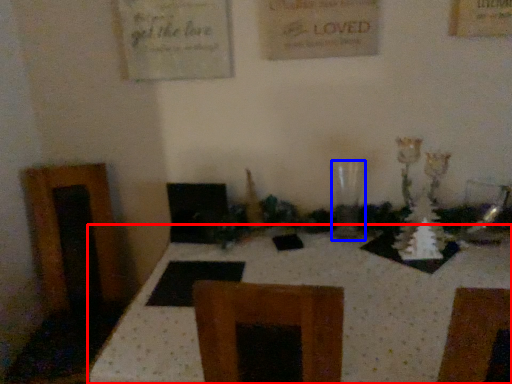
Question: Which object is closer to the camera taking this photo, table (highlighted by a red box) or glass vase (highlighted by a blue box)?

Choices:
 (A) table
 (B) glass vase

Answer: (A)